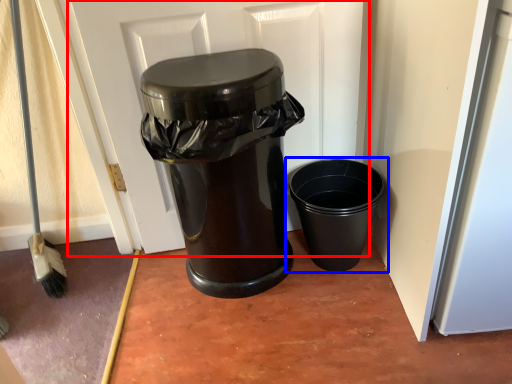
Question: Which object is further to the camera taking this photo, screen door (highlighted by a red box) or waste container (highlighted by a blue box)?

Choices:
 (A) screen door
 (B) waste container

Answer: (B)